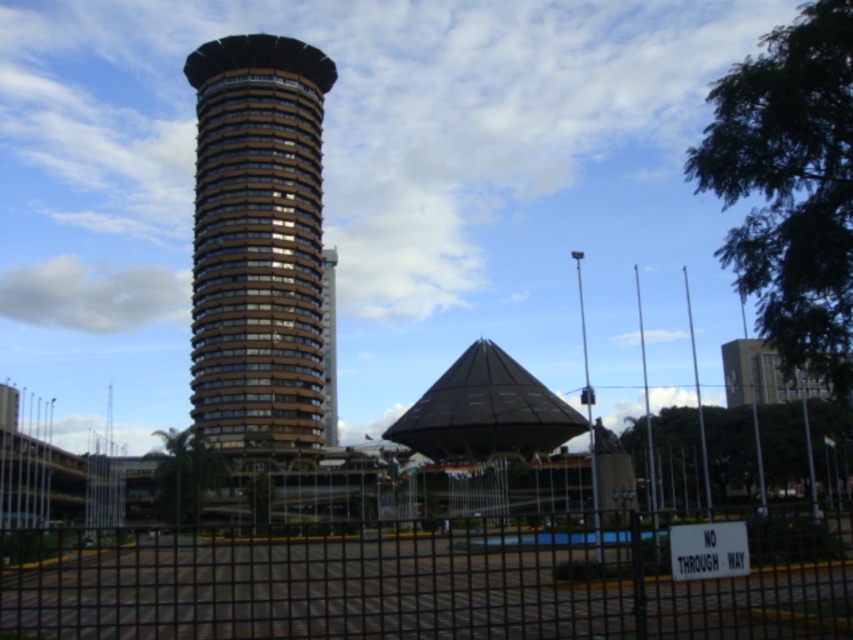
You are a city planner assessing the space between the black metal fence at lower center and the brown glass tower at center. Which object has a greater width?

The black metal fence at lower center has a greater width than the brown glass tower at center.

You are a delivery drone with a wingspan of 1.2 meters. You need to fly from the black metal fence at lower center to the brown glass tower at center. Is there enough space for you to navigate between them without touching either?

The distance between the black metal fence at lower center and the brown glass tower at center is 55.36 meters. Since your wingspan is only 1.2 meters, there is ample space for you to navigate between them without any issues.

You are standing at the fence with the No Through Way sign and want to reach both the point at coordinates point (515, 595) and point (276, 84). Which point do you need to walk towards first to reach them in the correct spatial order?

You should first walk towards point (515, 595) because it is in front of point (276, 84), so you can reach it first before moving to the latter point.